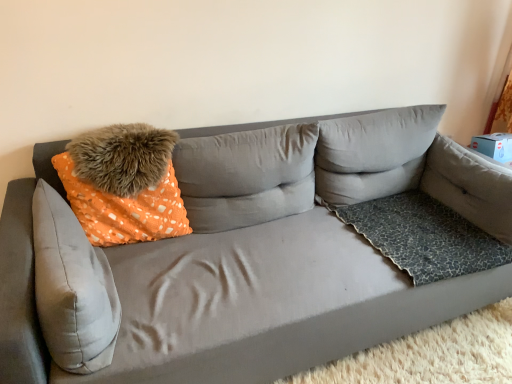
This screenshot has width=512, height=384. What do you see at coordinates (246, 176) in the screenshot? I see `orange dotted fabric pillow at upper center, the 3th pillow positioned from the right` at bounding box center [246, 176].

Measure the distance between leopard print fabric dog bed at right and camera.

The depth of leopard print fabric dog bed at right is 5.49 feet.

Describe the element at coordinates (122, 157) in the screenshot. I see `fuzzy fur pillow at upper left, acting as the second pillow starting from the left` at that location.

What are the coordinates of `leopard print fabric pillow at right, the 5th pillow in the left-to-right sequence` in the screenshot? It's located at (470, 186).

Measure the distance between orange dotted fabric pillow at left and suede gray pillow at left, acting as the fifth pillow starting from the right.

A distance of 29.58 centimeters exists between orange dotted fabric pillow at left and suede gray pillow at left, acting as the fifth pillow starting from the right.

Would you say orange dotted fabric pillow at left contains suede gray pillow at left, acting as the fifth pillow starting from the right?

Actually, suede gray pillow at left, acting as the fifth pillow starting from the right, is outside orange dotted fabric pillow at left.

Are orange dotted fabric pillow at left and suede gray pillow at left, acting as the first pillow starting from the left, located far from each other?

No.

Is orange dotted fabric pillow at left bigger or smaller than suede gray pillow at left, acting as the fifth pillow starting from the right?

In the image, orange dotted fabric pillow at left appears to be larger than suede gray pillow at left, acting as the fifth pillow starting from the right.

Measure the distance between leopard print fabric pillow at right, the 5th pillow in the left-to-right sequence, and fuzzy fur pillow at upper left, the fourth pillow in the right-to-left sequence.

The distance of leopard print fabric pillow at right, the 5th pillow in the left-to-right sequence, from fuzzy fur pillow at upper left, the fourth pillow in the right-to-left sequence, is 4.86 feet.

Is leopard print fabric pillow at right, the 5th pillow in the left-to-right sequence, facing towards fuzzy fur pillow at upper left, acting as the second pillow starting from the left?

No.

Considering the relative positions of leopard print fabric pillow at right, the 1th pillow from the right, and fuzzy fur pillow at upper left, acting as the second pillow starting from the left, in the image provided, is leopard print fabric pillow at right, the 1th pillow from the right, to the left of fuzzy fur pillow at upper left, acting as the second pillow starting from the left, from the viewer's perspective?

In fact, leopard print fabric pillow at right, the 1th pillow from the right, is to the right of fuzzy fur pillow at upper left, acting as the second pillow starting from the left.

Looking at this image, does leopard print fabric pillow at right, the 1th pillow from the right, have a lesser height compared to fuzzy fur pillow at upper left, the fourth pillow in the right-to-left sequence?

No, leopard print fabric pillow at right, the 1th pillow from the right, is not shorter than fuzzy fur pillow at upper left, the fourth pillow in the right-to-left sequence.

From the picture: From the image's perspective, is leopard print fabric dog bed at right over orange dotted fabric pillow at upper center, which is the 3th pillow in left-to-right order?

No, from the image's perspective, leopard print fabric dog bed at right is not above orange dotted fabric pillow at upper center, which is the 3th pillow in left-to-right order.

Measure the distance between leopard print fabric dog bed at right and orange dotted fabric pillow at upper center, the 3th pillow positioned from the right.

The distance of leopard print fabric dog bed at right from orange dotted fabric pillow at upper center, the 3th pillow positioned from the right, is 19.40 inches.

Based on the photo, from a real-world perspective, is leopard print fabric dog bed at right positioned above or below orange dotted fabric pillow at upper center, which is the 3th pillow in left-to-right order?

leopard print fabric dog bed at right is situated lower than orange dotted fabric pillow at upper center, which is the 3th pillow in left-to-right order, in the real world.

Based on their positions, is leopard print fabric dog bed at right located to the left or right of orange dotted fabric pillow at upper center, which is the 3th pillow in left-to-right order?

Based on their positions, leopard print fabric dog bed at right is located to the right of orange dotted fabric pillow at upper center, which is the 3th pillow in left-to-right order.

Is leopard print fabric dog bed at right in front of suede gray couch at center?

No.

Considering the relative sizes of leopard print fabric dog bed at right and suede gray couch at center in the image provided, is leopard print fabric dog bed at right wider than suede gray couch at center?

No, leopard print fabric dog bed at right is not wider than suede gray couch at center.

From the image's perspective, is leopard print fabric dog bed at right on suede gray couch at center?

No, from the image's perspective, leopard print fabric dog bed at right is not above suede gray couch at center.

From the image's perspective, is suede gray couch at center over suede gray pillow at left, acting as the first pillow starting from the left?

Yes.

Is suede gray couch at center behind suede gray pillow at left, acting as the first pillow starting from the left?

No, suede gray couch at center is closer to the viewer.

Is suede gray couch at center positioned far away from suede gray pillow at left, acting as the fifth pillow starting from the right?

No, suede gray couch at center is in close proximity to suede gray pillow at left, acting as the fifth pillow starting from the right.

Can you confirm if suede gray couch at center is positioned to the right of suede gray pillow at left, acting as the fifth pillow starting from the right?

Yes.

From the image's perspective, is suede gray pillow at left, acting as the first pillow starting from the left, above suede gray couch at center?

No.

Where is `pillow below the suede gray couch at center (from the image's perspective)`? pillow below the suede gray couch at center (from the image's perspective) is located at coordinates (72, 288).

How distant is suede gray pillow at left, acting as the first pillow starting from the left, from suede gray couch at center?

suede gray pillow at left, acting as the first pillow starting from the left, is 16.89 inches away from suede gray couch at center.

From the picture: From a real-world perspective, is suede gray pillow at left, acting as the fifth pillow starting from the right, positioned above or below suede gray couch at center?

suede gray pillow at left, acting as the fifth pillow starting from the right, is above suede gray couch at center.

Is leopard print fabric pillow at right, the 1th pillow from the right, with suede gray couch at center?

leopard print fabric pillow at right, the 1th pillow from the right, and suede gray couch at center are not in contact.

Is suede gray couch at center completely or partially inside leopard print fabric pillow at right, the 1th pillow from the right?

Definitely not — suede gray couch at center is not inside leopard print fabric pillow at right, the 1th pillow from the right.

In the image, is leopard print fabric pillow at right, the 1th pillow from the right, positioned in front of or behind suede gray couch at center?

leopard print fabric pillow at right, the 1th pillow from the right, is behind suede gray couch at center.

Between leopard print fabric pillow at right, the 5th pillow in the left-to-right sequence, and suede gray couch at center, which one has smaller width?

With smaller width is leopard print fabric pillow at right, the 5th pillow in the left-to-right sequence.

Image resolution: width=512 pixels, height=384 pixels. Find the location of `throw pillow that appears on the right of suede gray pillow at left, acting as the first pillow starting from the left`. throw pillow that appears on the right of suede gray pillow at left, acting as the first pillow starting from the left is located at coordinates (123, 184).

Identify the location of pillow that is the 2nd object located in front of the leopard print fabric pillow at right, the 5th pillow in the left-to-right sequence. (122, 157).

When comparing their distances from leopard print fabric pillow at right, the 5th pillow in the left-to-right sequence, does orange dotted fabric pillow at upper center, which is the 3th pillow in left-to-right order, or fuzzy fur pillow at upper left, the fourth pillow in the right-to-left sequence, seem closer?

orange dotted fabric pillow at upper center, which is the 3th pillow in left-to-right order, is closer to leopard print fabric pillow at right, the 5th pillow in the left-to-right sequence.

From the image, which object appears to be nearer to suede gray pillow at left, acting as the first pillow starting from the left, orange dotted fabric pillow at left or orange dotted fabric pillow at upper center, the 3th pillow positioned from the right?

orange dotted fabric pillow at left.

Consider the image. Estimate the real-world distances between objects in this image. Which object is further from orange dotted fabric pillow at left, leopard print fabric pillow at right, the 1th pillow from the right, or orange dotted fabric pillow at upper center, which is the 3th pillow in left-to-right order?

The object further to orange dotted fabric pillow at left is leopard print fabric pillow at right, the 1th pillow from the right.

Estimate the real-world distances between objects in this image. Which object is further from leopard print fabric pillow at right, the 1th pillow from the right, leopard print fabric dog bed at right or suede gray couch at center?

Based on the image, suede gray couch at center appears to be further to leopard print fabric pillow at right, the 1th pillow from the right.

Based on their spatial positions, is fuzzy fur pillow at upper left, the fourth pillow in the right-to-left sequence, or orange dotted fabric pillow at upper center, the 3th pillow positioned from the right, further from suede gray pillow at left, acting as the first pillow starting from the left?

Among the two, orange dotted fabric pillow at upper center, the 3th pillow positioned from the right, is located further to suede gray pillow at left, acting as the first pillow starting from the left.

From the image, which object appears to be nearer to leopard print fabric pillow at right, the 5th pillow in the left-to-right sequence, suede gray pillow at left, acting as the first pillow starting from the left, or leopard print fabric dog bed at right?

leopard print fabric dog bed at right is closer to leopard print fabric pillow at right, the 5th pillow in the left-to-right sequence.

Looking at the image, which one is located closer to fuzzy fur pillow at upper left, acting as the second pillow starting from the left, suede gray couch at center or leopard print fabric dog bed at right?

suede gray couch at center is positioned closer to the anchor fuzzy fur pillow at upper left, acting as the second pillow starting from the left.

Which object lies nearer to the anchor point leopard print fabric dog bed at right, orange dotted fabric pillow at upper center, the 3th pillow positioned from the right, or suede gray pillow at left, acting as the first pillow starting from the left?

Based on the image, orange dotted fabric pillow at upper center, the 3th pillow positioned from the right, appears to be nearer to leopard print fabric dog bed at right.

Image resolution: width=512 pixels, height=384 pixels. I want to click on studio couch between suede gray pillow at left, acting as the fifth pillow starting from the right, and leopard print fabric pillow at right, the 1th pillow from the right, so click(x=240, y=263).

Locate an element on the screen. This screenshot has width=512, height=384. dog bed between suede gray couch at center and leopard print fabric pillow at right, the 5th pillow in the left-to-right sequence, in the horizontal direction is located at coordinates (422, 236).

The height and width of the screenshot is (384, 512). In order to click on throw pillow located between suede gray pillow at left, acting as the first pillow starting from the left, and gray fabric pillow at upper right, the 4th pillow when ordered from left to right, in the left-right direction in this screenshot , I will do `click(123, 184)`.

You are a GUI agent. You are given a task and a screenshot of the screen. Output one action in this format:
    pyautogui.click(x=<x>, y=<y>)
    Task: Click on the studio couch between fuzzy fur pillow at upper left, the fourth pillow in the right-to-left sequence, and leopard print fabric pillow at right, the 5th pillow in the left-to-right sequence, from left to right
    
    Given the screenshot: What is the action you would take?
    pyautogui.click(x=240, y=263)